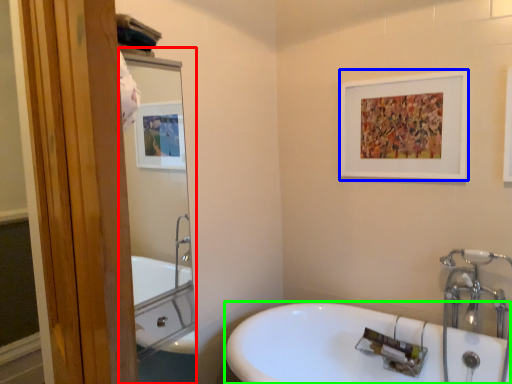
Question: Which is farther away from mirror (highlighted by a red box)? picture frame (highlighted by a blue box) or sink (highlighted by a green box)?

Choices:
 (A) picture frame
 (B) sink

Answer: (A)